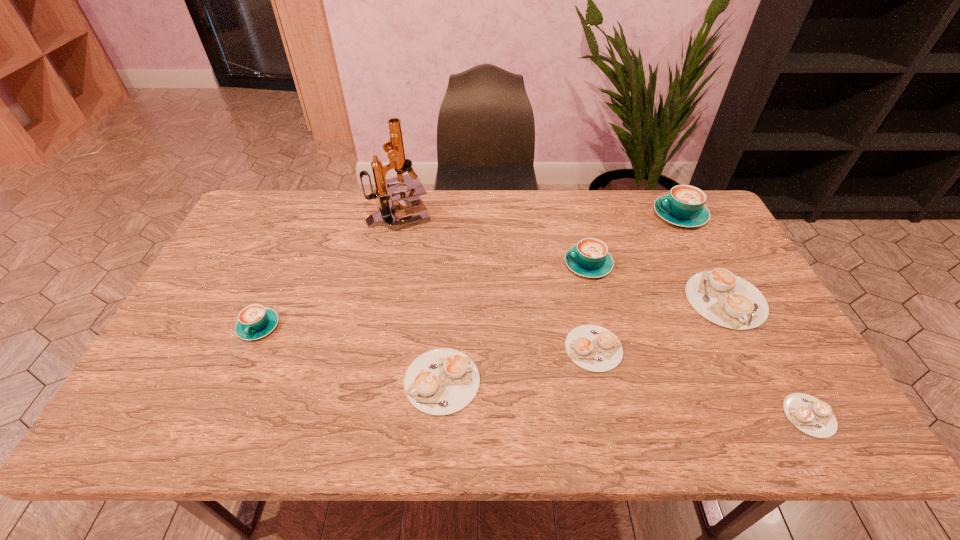
This screenshot has width=960, height=540. What are the coordinates of `the third smallest white cappuccino` in the screenshot? It's located at (442, 381).

Identify the location of the leftmost white cappuccino. (442, 381).

The width and height of the screenshot is (960, 540). In order to click on the seventh tallest object in this screenshot , I will do `click(594, 348)`.

At what (x,y) coordinates should I click in order to perform the action: click on the third biggest white cappuccino. Please return your answer as a coordinate pair (x, y). The image size is (960, 540). Looking at the image, I should click on (594, 348).

I want to click on the shortest cappuccino, so click(x=810, y=415).

This screenshot has width=960, height=540. I want to click on the smallest white cappuccino, so click(810, 415).

Find the location of a particular element. This screenshot has width=960, height=540. vacant space located at the eyepiece of the microscope is located at coordinates (538, 214).

In order to click on free space located with the handle on the right side of the seventh shortest object in this screenshot , I will do (x=576, y=215).

This screenshot has height=540, width=960. In order to click on vacant space located with the handle on the right side of the seventh shortest object in this screenshot , I will do `click(636, 215)`.

Image resolution: width=960 pixels, height=540 pixels. What are the coordinates of `vacant space situated with the handle on the right side of the seventh shortest object` in the screenshot? It's located at (564, 215).